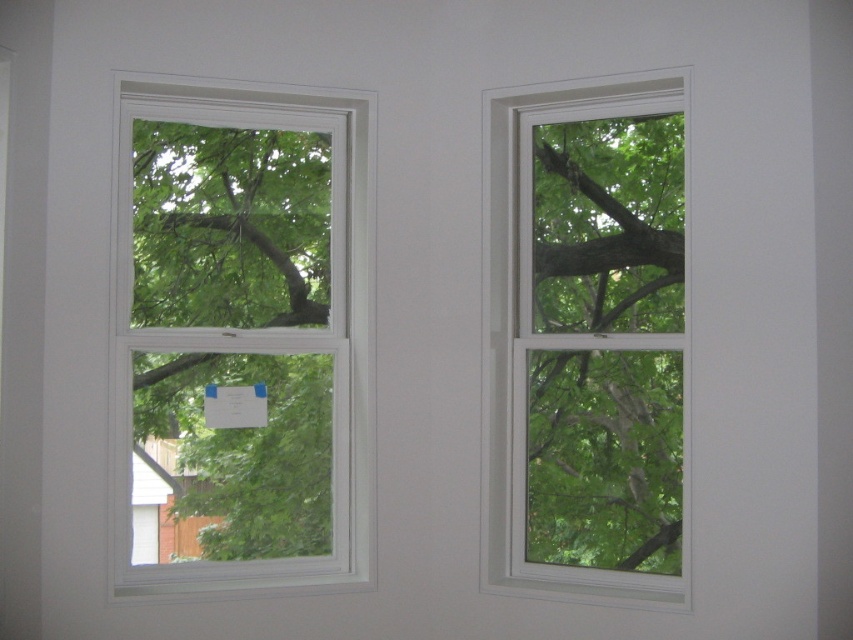
Between white plastic window at left and white plastic window at center, which one has more height?

Standing taller between the two is white plastic window at center.

Does white plastic window at left appear over white plastic window at center?

Yes, white plastic window at left is above white plastic window at center.

Image resolution: width=853 pixels, height=640 pixels. I want to click on white plastic window at left, so click(241, 337).